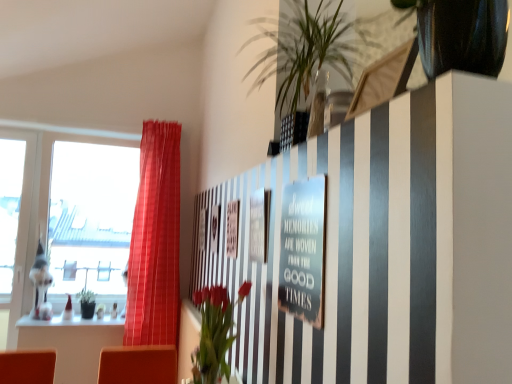
Question: From the image's perspective, would you say matte red curtain at left is shown under metallic silver sign at center?

Choices:
 (A) yes
 (B) no

Answer: (A)

Question: Considering the relative sizes of matte red curtain at left and metallic silver sign at center in the image provided, is matte red curtain at left shorter than metallic silver sign at center?

Choices:
 (A) yes
 (B) no

Answer: (B)

Question: Is matte red curtain at left positioned behind metallic silver sign at center?

Choices:
 (A) yes
 (B) no

Answer: (A)

Question: Can you confirm if matte red curtain at left is positioned to the right of metallic silver sign at center?

Choices:
 (A) no
 (B) yes

Answer: (A)

Question: Can you confirm if matte red curtain at left is thinner than metallic silver sign at center?

Choices:
 (A) yes
 (B) no

Answer: (B)

Question: Is matte red curtain at left oriented away from metallic silver sign at center?

Choices:
 (A) yes
 (B) no

Answer: (B)

Question: Is vivid red flowers at center directly adjacent to matte red curtain at left?

Choices:
 (A) no
 (B) yes

Answer: (A)

Question: Does vivid red flowers at center have a larger size compared to matte red curtain at left?

Choices:
 (A) yes
 (B) no

Answer: (B)

Question: From the image's perspective, is vivid red flowers at center above matte red curtain at left?

Choices:
 (A) no
 (B) yes

Answer: (A)

Question: Is vivid red flowers at center oriented away from matte red curtain at left?

Choices:
 (A) no
 (B) yes

Answer: (A)

Question: Is vivid red flowers at center far from matte red curtain at left?

Choices:
 (A) yes
 (B) no

Answer: (A)

Question: From a real-world perspective, is vivid red flowers at center on top of matte red curtain at left?

Choices:
 (A) no
 (B) yes

Answer: (A)

Question: Is metallic silver sign at center at the left side of vivid red flowers at center?

Choices:
 (A) yes
 (B) no

Answer: (B)